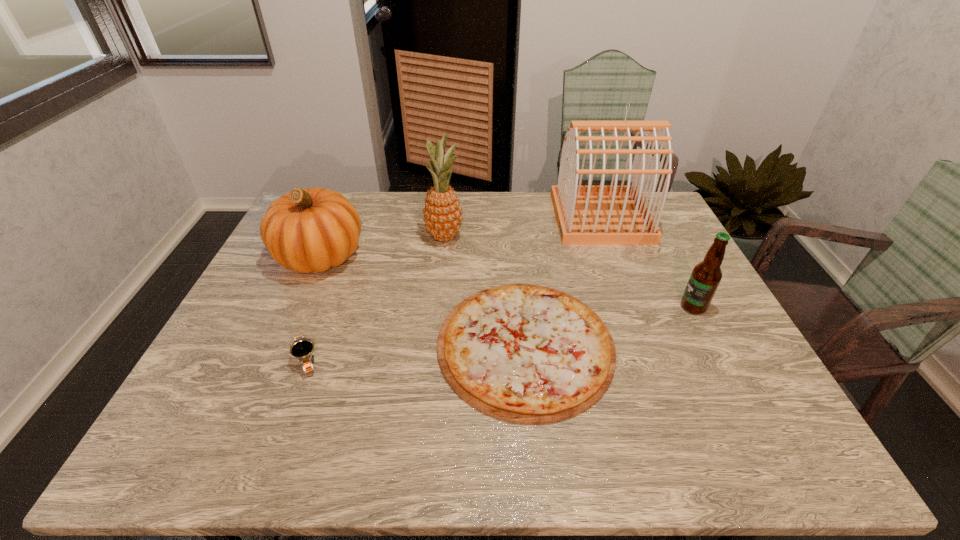
Find the location of a particular element. object that is positioned at the left edge is located at coordinates (x=306, y=230).

This screenshot has width=960, height=540. What are the coordinates of `birdcage at the right edge` in the screenshot? It's located at pos(586,215).

Locate an element on the screen. beer bottle present at the right edge is located at coordinates click(x=705, y=278).

This screenshot has height=540, width=960. I want to click on object at the far left corner, so click(306, 230).

The width and height of the screenshot is (960, 540). I want to click on object present at the far right corner, so click(x=586, y=215).

This screenshot has height=540, width=960. In the image, there is a desktop. What are the coordinates of `free region at the far edge` in the screenshot? It's located at (370, 225).

The height and width of the screenshot is (540, 960). In the image, there is a desktop. Find the location of `free region at the left edge`. free region at the left edge is located at coordinates (253, 292).

Image resolution: width=960 pixels, height=540 pixels. What are the coordinates of `vacant region at the right edge of the desktop` in the screenshot? It's located at (686, 359).

Locate an element on the screen. This screenshot has height=540, width=960. free space at the far right corner of the desktop is located at coordinates (661, 218).

The width and height of the screenshot is (960, 540). Identify the location of vacant space at the near right corner of the desktop. (805, 460).